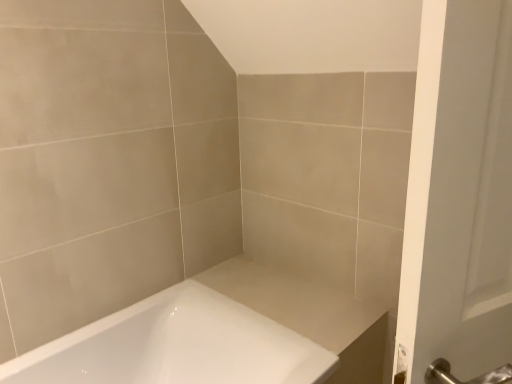
In order to face white smooth countertop at center, should I rotate leftwards or rightwards?

Rotate your view right by about 3.803°.

This screenshot has height=384, width=512. What do you see at coordinates (298, 303) in the screenshot? I see `white smooth countertop at center` at bounding box center [298, 303].

Identify the location of white smooth countertop at center. The height and width of the screenshot is (384, 512). (298, 303).

Locate an element on the screen. The height and width of the screenshot is (384, 512). white smooth countertop at center is located at coordinates click(298, 303).